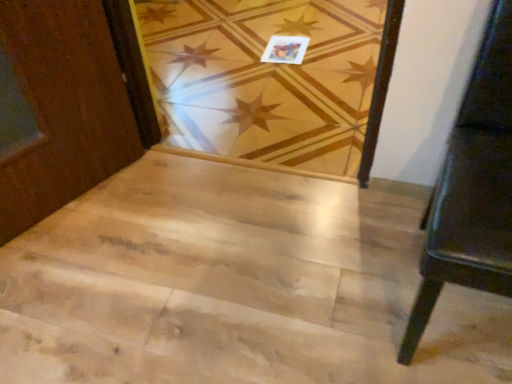
The height and width of the screenshot is (384, 512). Find the location of `vacant space positioned to the left of matte paper postcard at upper center`. vacant space positioned to the left of matte paper postcard at upper center is located at coordinates (239, 50).